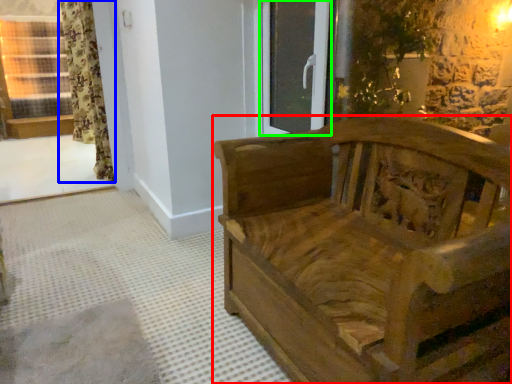
Question: Which object is the closest to the furniture (highlighted by a red box)? Choose among these: curtain (highlighted by a blue box) or glass door (highlighted by a green box).

Choices:
 (A) curtain
 (B) glass door

Answer: (B)